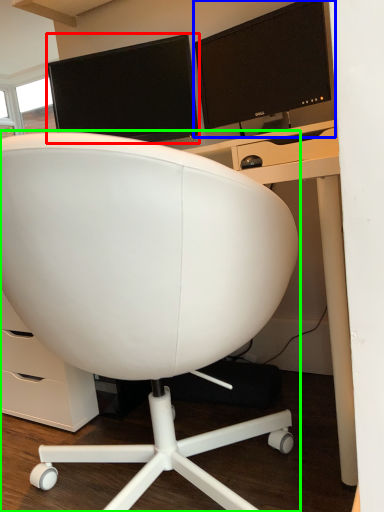
Question: Based on their relative distances, which object is nearer to computer monitor (highlighted by a red box)? Choose from computer monitor (highlighted by a blue box) and chair (highlighted by a green box).

Choices:
 (A) computer monitor
 (B) chair

Answer: (A)